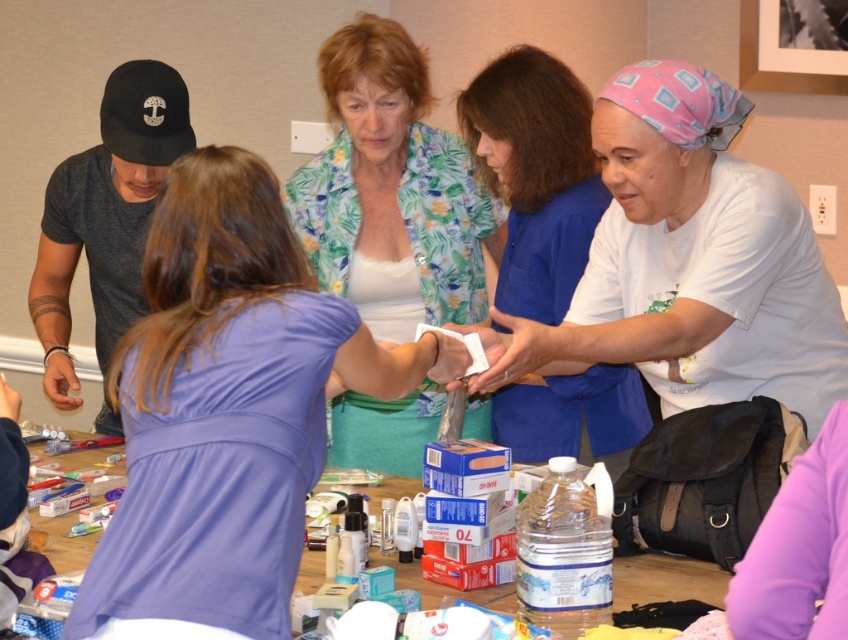
Question: Considering the real-world distances, which object is farthest from the matte skin hand at center?

Choices:
 (A) matte white paper at center
 (B) pink fabric headscarf at upper right

Answer: (B)

Question: Is pink fabric headscarf at upper right positioned behind dark gray cotton t-shirt at left?

Choices:
 (A) yes
 (B) no

Answer: (B)

Question: Is white matte shirt at center above matte skin hand at center?

Choices:
 (A) yes
 (B) no

Answer: (A)

Question: Which of the following is the farthest from the observer?

Choices:
 (A) wooden table at center
 (B) floral fabric blouse at center

Answer: (B)

Question: Which of the following is the farthest from the observer?

Choices:
 (A) (636, 566)
 (B) (6, 396)
 (C) (47, 353)

Answer: (C)

Question: Is the position of white matte shirt at center more distant than that of pink fabric headscarf at upper right?

Choices:
 (A) yes
 (B) no

Answer: (B)